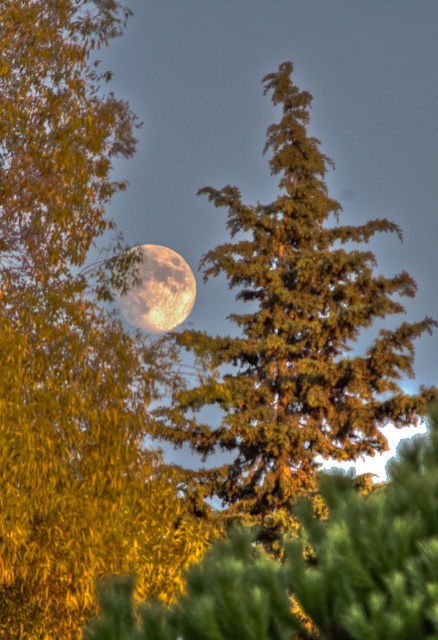
Does yellow-green leaves at upper left have a greater height compared to green textured pine tree at center?

Incorrect, yellow-green leaves at upper left's height is not larger of green textured pine tree at center's.

Does point (78, 564) come in front of point (303, 353)?

Yes, point (78, 564) is in front of point (303, 353).

Locate an element on the screen. The image size is (438, 640). yellow-green leaves at upper left is located at coordinates (73, 340).

Between green textured pine tree at center and golden textured moon at center, which one appears on the right side from the viewer's perspective?

green textured pine tree at center

Which is in front, point (209, 429) or point (193, 276)?

Positioned in front is point (209, 429).

Identify the location of green textured pine tree at center. (293, 337).

Between yellow-green leaves at upper left and golden textured moon at center, which one appears on the right side from the viewer's perspective?

yellow-green leaves at upper left is more to the right.

Is yellow-green leaves at upper left thinner than golden textured moon at center?

Yes, yellow-green leaves at upper left is thinner than golden textured moon at center.

Does point (95, 90) come closer to viewer compared to point (148, 259)?

Yes.

Identify the location of yellow-green leaves at upper left. (73, 340).